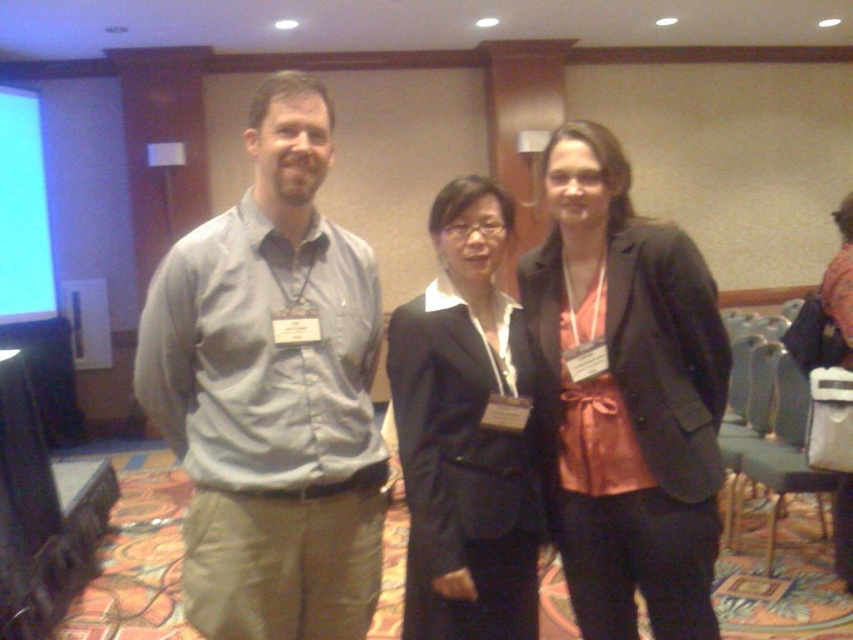
Is gray cotton shirt at center taller than matte black blazer at center?

Incorrect, gray cotton shirt at center's height is not larger of matte black blazer at center's.

Is point (247, 620) positioned before point (572, 376)?

Yes, it is.

I want to click on gray cotton shirt at center, so click(x=271, y=392).

Is point (236, 586) closer to viewer compared to point (469, 312)?

That is True.

Does gray cotton shirt at center have a lesser width compared to black matte suit at center?

In fact, gray cotton shirt at center might be wider than black matte suit at center.

The width and height of the screenshot is (853, 640). Identify the location of gray cotton shirt at center. (271, 392).

Which is above, matte black blazer at center or black matte suit at center?

Positioned higher is matte black blazer at center.

Does point (579, 456) come behind point (505, 317)?

No, it is in front of (505, 317).

Is point (643, 380) farther from viewer compared to point (497, 250)?

That is False.

Find the location of a particular element. The image size is (853, 640). matte black blazer at center is located at coordinates (625, 396).